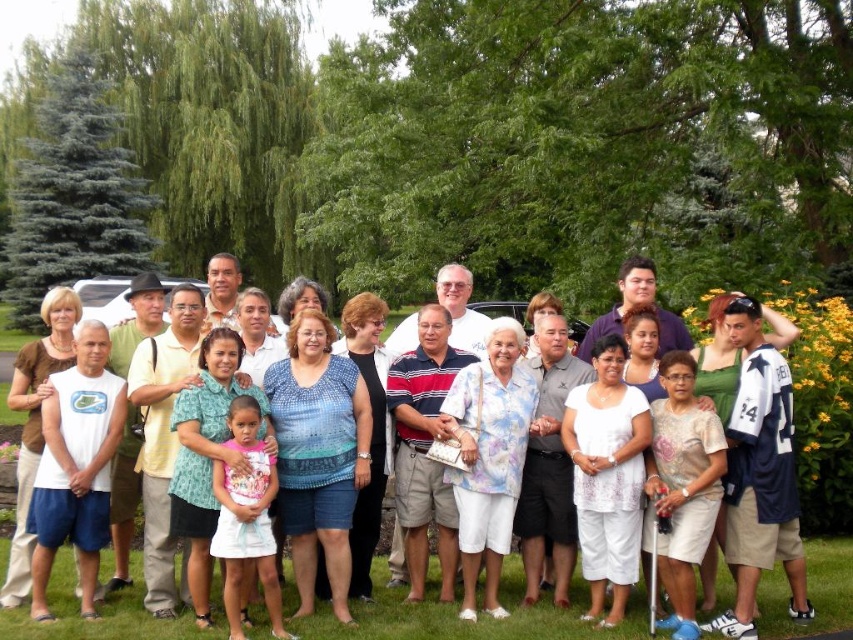
You are a photographer setting up for a group photo in the park. You have to place a white fabric golf course at lower center and a white cotton shirt at center. Considering their sizes, which object should you position closer to the camera to make them appear the same size in the photo?

The white fabric golf course at lower center is smaller than the white cotton shirt at center, so to make them appear the same size in the photo, you should position the white fabric golf course at lower center closer to the camera than the white cotton shirt at center.

You are a photographer setting up a shot of the group. You want to ensure the white fabric golf course at lower center and the white cotton shirt at center are both visible. Which object might appear narrower in the photo?

The white fabric golf course at lower center is thinner than the white cotton shirt at center, so it will appear narrower in the photo.

You are a photographer trying to capture a clear shot of the white cotton shirt at center and the white fabric golf course at lower center. However, the golf course is blocking part of the shirt. Can you adjust your position to see both objects clearly without any obstruction?

The white cotton shirt at center is behind the white fabric golf course at lower center, so moving your position slightly to the side might allow you to see both objects without obstruction.